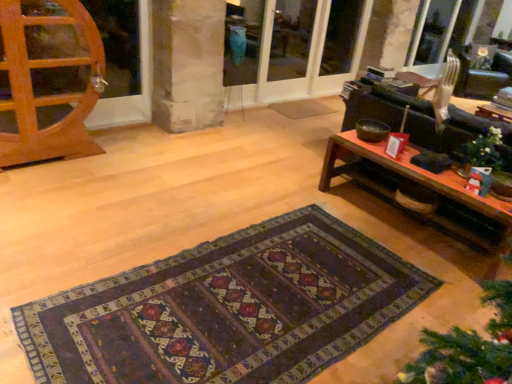
Question: Considering the relative positions of matte glass screen door at center, the second screen door in the left-to-right sequence, and metallic silver armchair at upper right in the image provided, is matte glass screen door at center, the second screen door in the left-to-right sequence, to the right of metallic silver armchair at upper right from the viewer's perspective?

Choices:
 (A) no
 (B) yes

Answer: (A)

Question: Is matte glass screen door at center, marked as the 2th screen door in a right-to-left arrangement, with metallic silver armchair at upper right?

Choices:
 (A) yes
 (B) no

Answer: (B)

Question: Is matte glass screen door at center, the second screen door in the left-to-right sequence, shorter than metallic silver armchair at upper right?

Choices:
 (A) no
 (B) yes

Answer: (A)

Question: From a real-world perspective, does matte glass screen door at center, marked as the 2th screen door in a right-to-left arrangement, sit lower than metallic silver armchair at upper right?

Choices:
 (A) no
 (B) yes

Answer: (A)

Question: Can you confirm if matte glass screen door at center, marked as the 2th screen door in a right-to-left arrangement, is thinner than metallic silver armchair at upper right?

Choices:
 (A) no
 (B) yes

Answer: (B)

Question: From the image's perspective, is dark woven rug at center above or below wooden coffee table at right?

Choices:
 (A) below
 (B) above

Answer: (A)

Question: Is dark woven rug at center wider or thinner than wooden coffee table at right?

Choices:
 (A) thin
 (B) wide

Answer: (B)

Question: In the image, is dark woven rug at center positioned in front of or behind wooden coffee table at right?

Choices:
 (A) behind
 (B) front

Answer: (B)

Question: Does point (251, 357) appear closer or farther from the camera than point (347, 140)?

Choices:
 (A) farther
 (B) closer

Answer: (B)

Question: Is matte glass screen door at center, the second screen door in the left-to-right sequence, bigger or smaller than transparent glass screen door at upper center, the 3th screen door positioned from the left?

Choices:
 (A) big
 (B) small

Answer: (A)

Question: Is matte glass screen door at center, marked as the 2th screen door in a right-to-left arrangement, taller or shorter than transparent glass screen door at upper center, the 3th screen door positioned from the left?

Choices:
 (A) tall
 (B) short

Answer: (A)

Question: Does point (275, 11) appear closer or farther from the camera than point (315, 87)?

Choices:
 (A) closer
 (B) farther

Answer: (A)

Question: From the image's perspective, is matte glass screen door at center, marked as the 2th screen door in a right-to-left arrangement, above or below transparent glass screen door at upper center, the 3th screen door positioned from the left?

Choices:
 (A) below
 (B) above

Answer: (A)

Question: From the image's perspective, is white matte christmas ornament at right above or below transparent glass screen door at upper center, the 3th screen door positioned from the left?

Choices:
 (A) above
 (B) below

Answer: (B)

Question: Would you say white matte christmas ornament at right is to the left or to the right of transparent glass screen door at upper center, marked as the first screen door in a right-to-left arrangement, in the picture?

Choices:
 (A) left
 (B) right

Answer: (B)